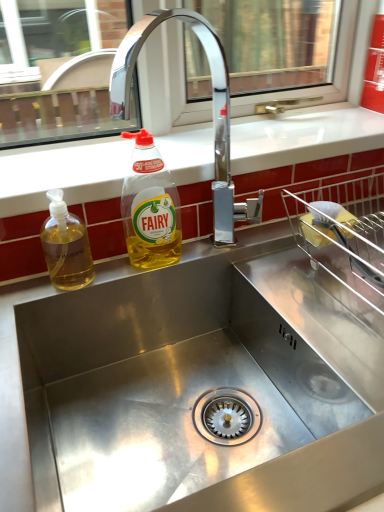
Question: Can you confirm if yellow translucent liquid at upper center, which is counted as the second bottle, starting from the left, is bigger than translucent yellow liquid at sink left, which is counted as the first bottle, starting from the left?

Choices:
 (A) no
 (B) yes

Answer: (B)

Question: From a real-world perspective, is yellow translucent liquid at upper center, positioned as the first bottle in right-to-left order, over translucent yellow liquid at sink left, which is counted as the first bottle, starting from the left?

Choices:
 (A) no
 (B) yes

Answer: (B)

Question: Is the position of yellow translucent liquid at upper center, which is counted as the second bottle, starting from the left, more distant than that of translucent yellow liquid at sink left, the 2th bottle when ordered from right to left?

Choices:
 (A) yes
 (B) no

Answer: (A)

Question: Is yellow translucent liquid at upper center, positioned as the first bottle in right-to-left order, at the left side of translucent yellow liquid at sink left, which is counted as the first bottle, starting from the left?

Choices:
 (A) no
 (B) yes

Answer: (A)

Question: Is yellow translucent liquid at upper center, which is counted as the second bottle, starting from the left, facing away from translucent yellow liquid at sink left, which is counted as the first bottle, starting from the left?

Choices:
 (A) no
 (B) yes

Answer: (A)

Question: From the image's perspective, is yellow translucent liquid at upper center, positioned as the first bottle in right-to-left order, beneath translucent yellow liquid at sink left, which is counted as the first bottle, starting from the left?

Choices:
 (A) no
 (B) yes

Answer: (A)

Question: Is translucent yellow liquid at sink left, which is counted as the first bottle, starting from the left, touching white glossy countertop at upper center?

Choices:
 (A) no
 (B) yes

Answer: (A)

Question: From a real-world perspective, is translucent yellow liquid at sink left, which is counted as the first bottle, starting from the left, over white glossy countertop at upper center?

Choices:
 (A) no
 (B) yes

Answer: (A)

Question: Does translucent yellow liquid at sink left, the 2th bottle when ordered from right to left, lie behind white glossy countertop at upper center?

Choices:
 (A) no
 (B) yes

Answer: (A)

Question: From the image's perspective, would you say translucent yellow liquid at sink left, which is counted as the first bottle, starting from the left, is positioned over white glossy countertop at upper center?

Choices:
 (A) no
 (B) yes

Answer: (A)

Question: Is translucent yellow liquid at sink left, which is counted as the first bottle, starting from the left, closer to camera compared to white glossy countertop at upper center?

Choices:
 (A) yes
 (B) no

Answer: (A)

Question: Considering the relative positions of translucent yellow liquid at sink left, the 2th bottle when ordered from right to left, and white glossy countertop at upper center in the image provided, is translucent yellow liquid at sink left, the 2th bottle when ordered from right to left, to the right of white glossy countertop at upper center from the viewer's perspective?

Choices:
 (A) no
 (B) yes

Answer: (A)

Question: From a real-world perspective, is translucent yellow liquid at sink left, which is counted as the first bottle, starting from the left, located higher than yellow translucent liquid at upper center, which is counted as the second bottle, starting from the left?

Choices:
 (A) yes
 (B) no

Answer: (B)